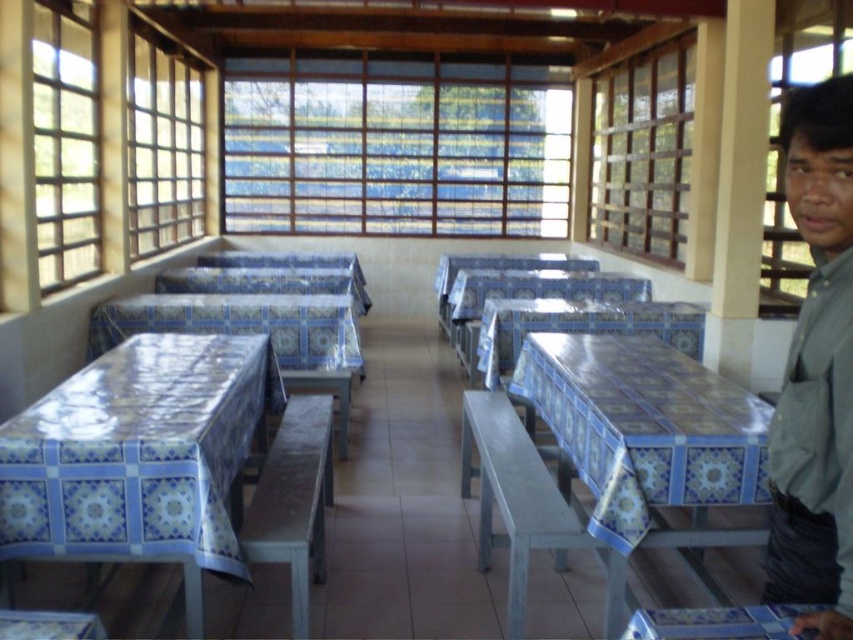
You are standing at the entrance of the dining area and want to walk towards the point at coordinates point (604, 497). However, there is an obstacle located at point (339, 368). Will you encounter the obstacle before reaching your destination?

Point (604, 497) is in front of point (339, 368), so you will encounter the obstacle at point (339, 368) before reaching your destination.

You are a guest at this dining area and want to choose a table for two. You prefer a smaller table to have more privacy. Which table should you choose between the blue tile table at right and the blue tile table at center?

You should choose the blue tile table at right because it is smaller than the blue tile table at center, providing more privacy.